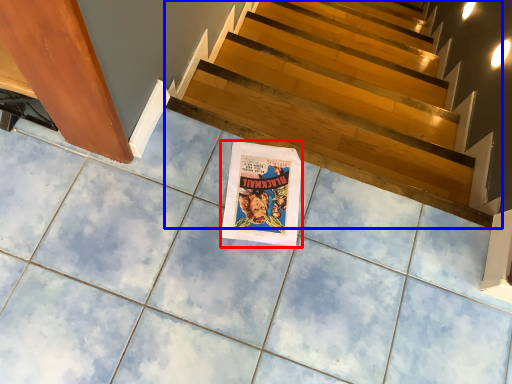
Question: Which point is further to the camera, movie poster (highlighted by a red box) or stairs (highlighted by a blue box)?

Choices:
 (A) movie poster
 (B) stairs

Answer: (B)